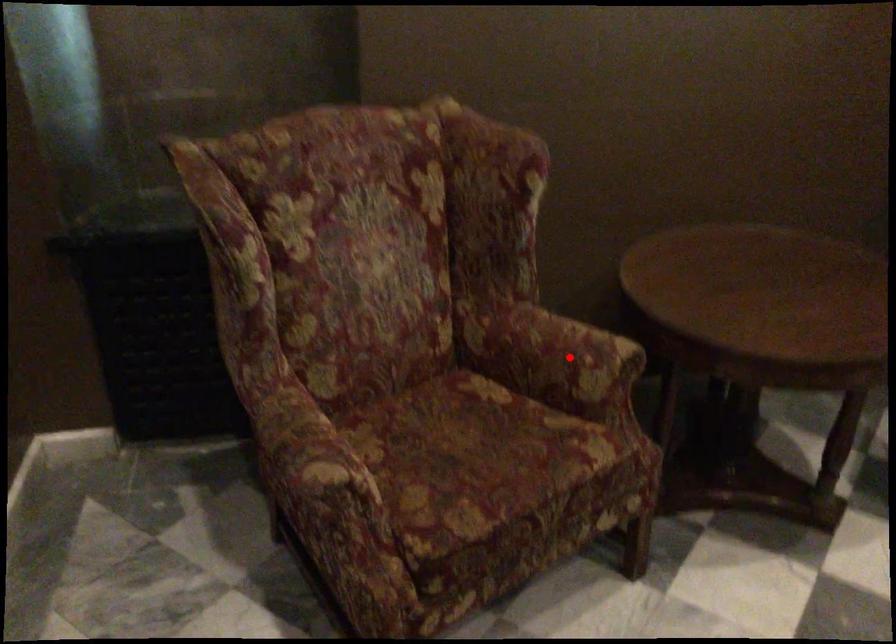
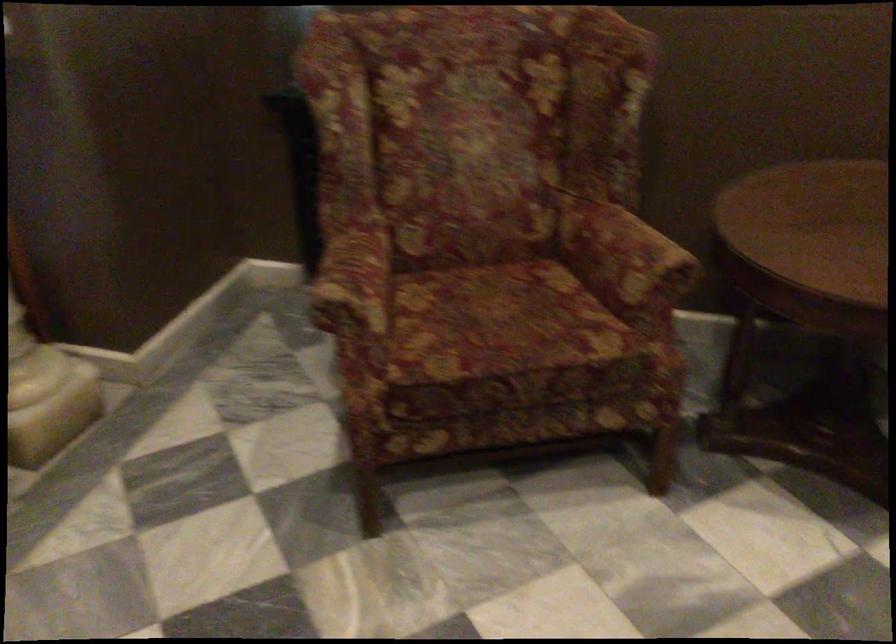
In the second image, find the point that corresponds to the highlighted location in the first image.

(624, 258)